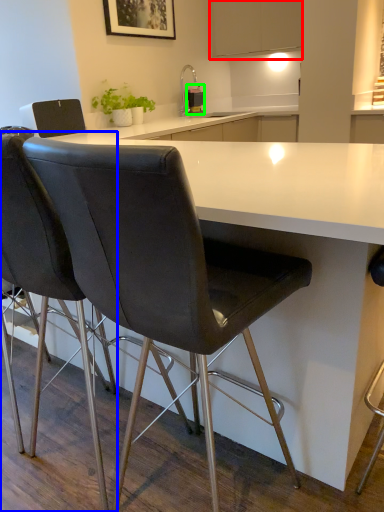
Question: Which is farther away from cabinetry (highlighted by a red box)? chair (highlighted by a blue box) or kitchen appliance (highlighted by a green box)?

Choices:
 (A) chair
 (B) kitchen appliance

Answer: (A)